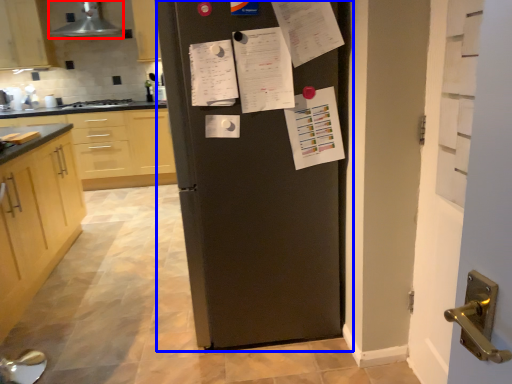
Question: Among these objects, which one is nearest to the camera, exhaust hood (highlighted by a red box) or refrigerator (highlighted by a blue box)?

Choices:
 (A) exhaust hood
 (B) refrigerator

Answer: (B)